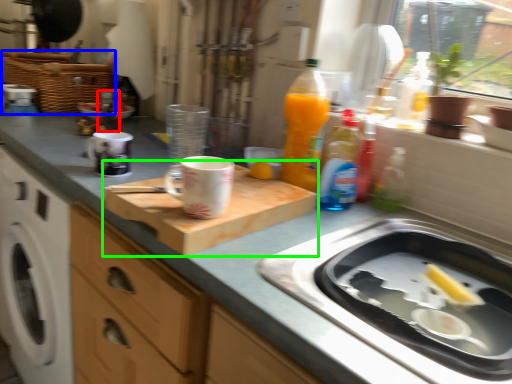
Question: Which object is the closest to the bottle (highlighted by a red box)? Choose among these: basket (highlighted by a blue box) or cutting board (highlighted by a green box).

Choices:
 (A) basket
 (B) cutting board

Answer: (A)